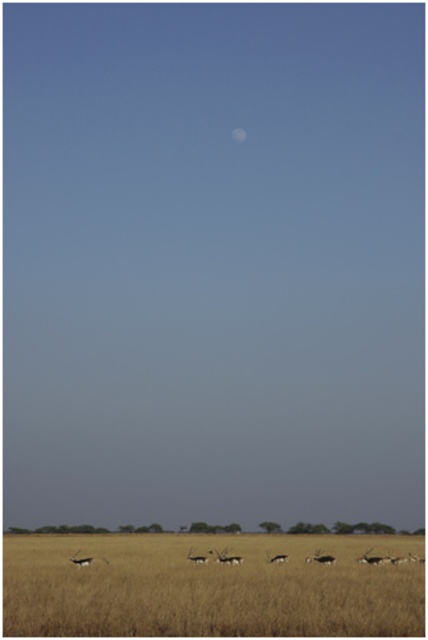
You are standing at the point marked as point (350,529) in the image. What is the most likely terrain feature you are currently standing on?

The brown grassland at lower center is located at point (350,529), so you are most likely standing on the brown grassland at lower center.

You are a wildlife photographer aiming to capture a photo of the smooth brown antelope at lower left. Based on its 2D coordinates in the image, where should you position your camera to ensure it is centered in the frame?

To center the smooth brown antelope at lower left in your photo, position your camera so that its center aligns with the coordinates point [80,561].

You are a wildlife photographer trying to capture a photo of the smooth brown antelope at lower left and the brown textured antelope at center. Which antelope should you focus on if you want to photograph the taller one?

The brown textured antelope at center is taller than the smooth brown antelope at lower left, so you should focus on the brown textured antelope at center to photograph the taller one.